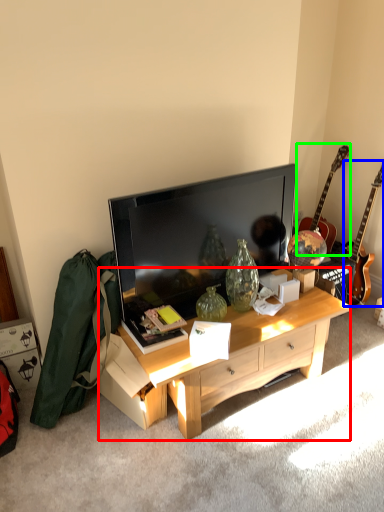
Question: Considering the real-world distances, which object is farthest from desk (highlighted by a red box)? guitar (highlighted by a blue box) or guitar (highlighted by a green box)?

Choices:
 (A) guitar
 (B) guitar

Answer: (B)